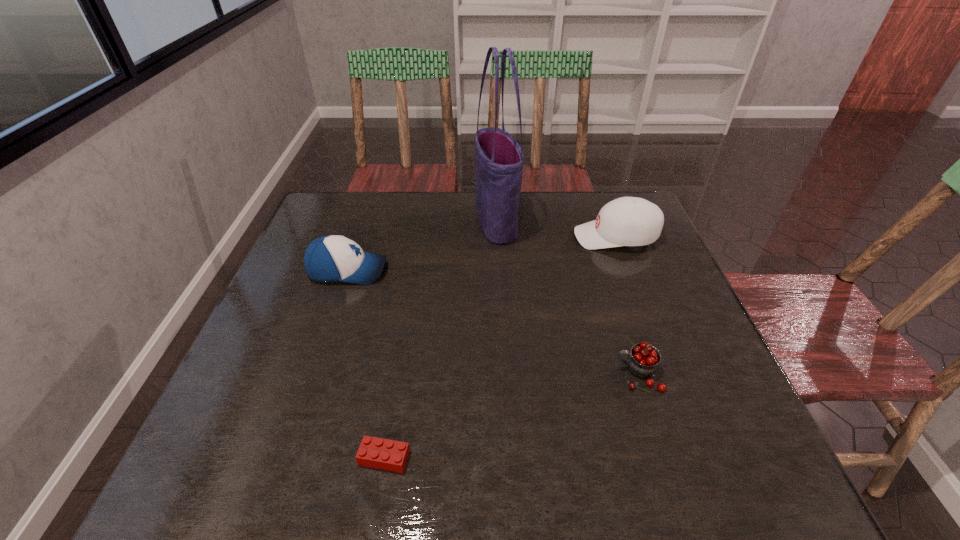
In order to click on free region that satisfies the following two spatial constraints: 1. on the front-facing side of the right baseball cap; 2. on the front side of the nearest object in this screenshot , I will do `click(699, 457)`.

At what (x,y) coordinates should I click in order to perform the action: click on vacant space that satisfies the following two spatial constraints: 1. on the back side of the nearest object; 2. on the front-facing side of the nearer baseball cap. Please return your answer as a coordinate pair (x, y). The height and width of the screenshot is (540, 960). Looking at the image, I should click on (416, 271).

Locate an element on the screen. This screenshot has width=960, height=540. vacant point that satisfies the following two spatial constraints: 1. on the handle side of the fourth farthest object; 2. on the front-facing side of the left baseball cap is located at coordinates (605, 271).

Where is `free region that satisfies the following two spatial constraints: 1. on the front-facing side of the nearer baseball cap; 2. on the handle side of the second nearest object`? free region that satisfies the following two spatial constraints: 1. on the front-facing side of the nearer baseball cap; 2. on the handle side of the second nearest object is located at coordinates (313, 374).

Find the location of a particular element. free space that satisfies the following two spatial constraints: 1. on the front-facing side of the farther baseball cap; 2. on the front side of the shortest object is located at coordinates (699, 457).

I want to click on vacant space that satisfies the following two spatial constraints: 1. on the handle side of the second nearest object; 2. on the front-facing side of the third farthest object, so click(605, 271).

Identify the location of vacant space that satisfies the following two spatial constraints: 1. on the front side of the tallest object; 2. on the handle side of the fourth farthest object. The height and width of the screenshot is (540, 960). (503, 374).

Find the location of a particular element. Image resolution: width=960 pixels, height=540 pixels. vacant region that satisfies the following two spatial constraints: 1. on the handle side of the second nearest object; 2. on the front-facing side of the left baseball cap is located at coordinates (605, 271).

Image resolution: width=960 pixels, height=540 pixels. Identify the location of vacant space that satisfies the following two spatial constraints: 1. on the back side of the fourth object from right to left; 2. on the front-facing side of the third nearest object. (416, 271).

Image resolution: width=960 pixels, height=540 pixels. Identify the location of vacant space that satisfies the following two spatial constraints: 1. on the front-facing side of the nearer baseball cap; 2. on the right side of the shortest object. (284, 457).